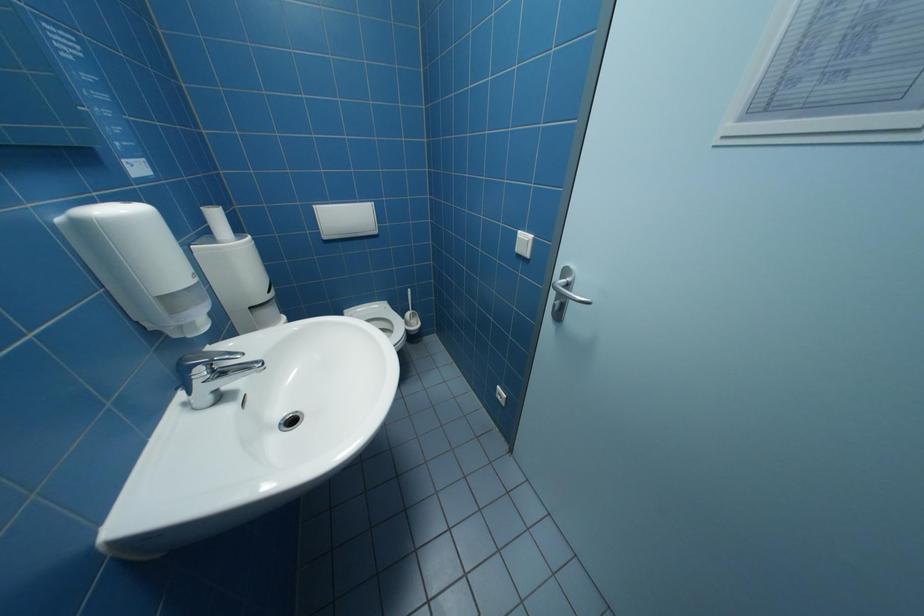
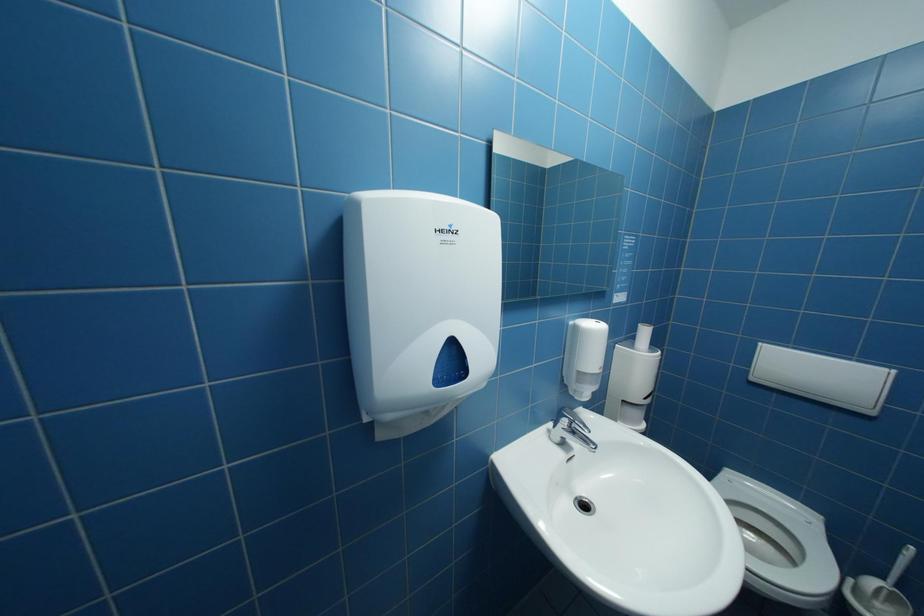
Question: The camera is either moving clockwise (left) or counter-clockwise (right) around the object. The first image is from the beginning of the video and the second image is from the end. Is the camera moving left or right when shooting the video?

Choices:
 (A) Left
 (B) Right

Answer: (B)